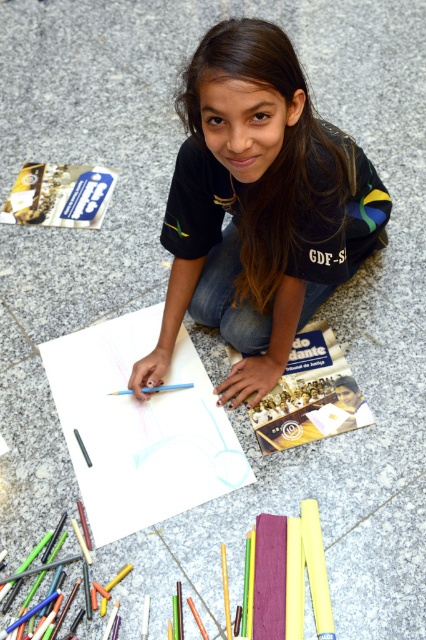
Can you confirm if matte black shirt at center is positioned above white paper at center?

Yes.

Can you confirm if matte black shirt at center is taller than white paper at center?

Indeed, matte black shirt at center has a greater height compared to white paper at center.

Who is more forward, (261,328) or (94,374)?

Point (261,328)

Where is `matte black shirt at center`? The image size is (426, 640). matte black shirt at center is located at coordinates (258, 205).